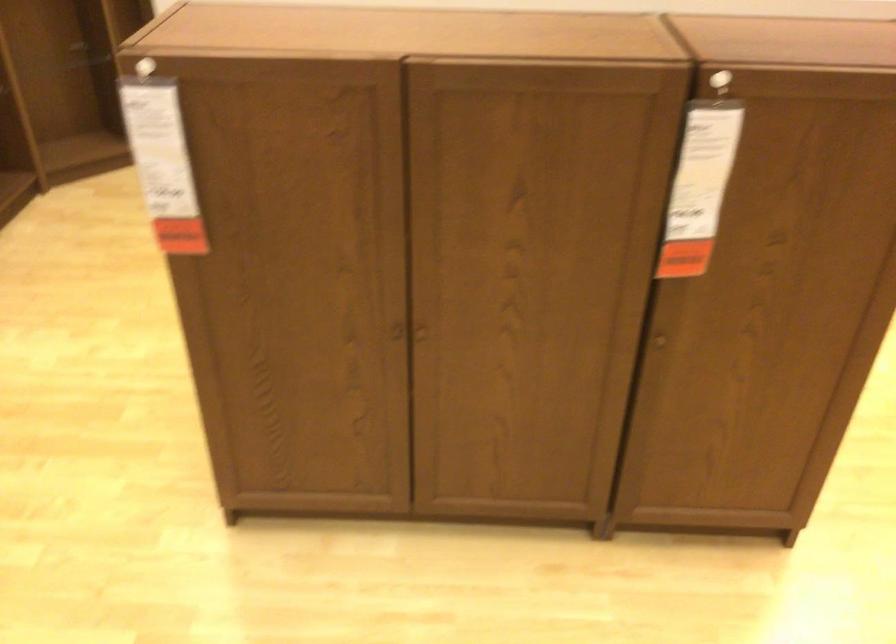
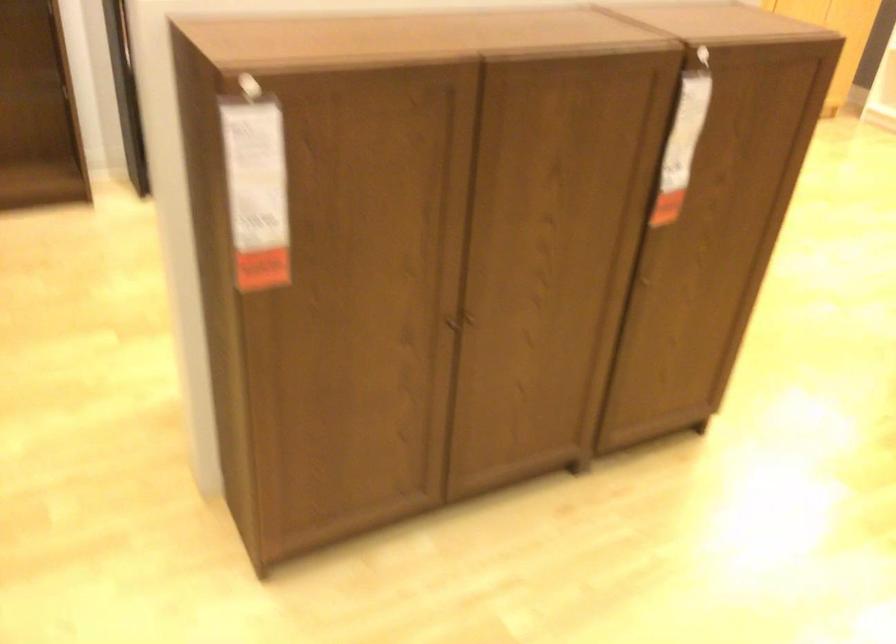
Question: The camera is either moving clockwise (left) or counter-clockwise (right) around the object. The first image is from the beginning of the video and the second image is from the end. Is the camera moving left or right when shooting the video?

Choices:
 (A) Left
 (B) Right

Answer: (A)